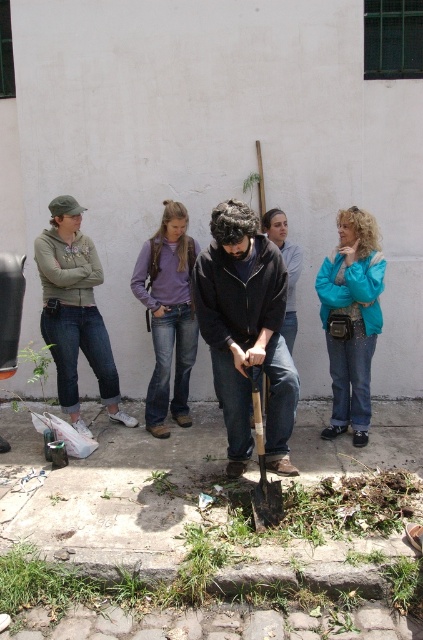
Question: Among these objects, which one is farthest from the camera?

Choices:
 (A) green leafy plant at center
 (B) dark brown leather jacket at center
 (C) green grass at lower left

Answer: (A)

Question: In this image, where is dark brown leather jacket at center located relative to wooden shovel at center?

Choices:
 (A) right
 (B) left

Answer: (B)

Question: Does green leafy plant at lower center have a greater width compared to green leafy plant at lower left?

Choices:
 (A) no
 (B) yes

Answer: (A)

Question: Based on their relative distances, which object is farther from the green cotton hoodie at left?

Choices:
 (A) dark brown leather jacket at center
 (B) green grass at lower left
 (C) wooden shovel at center

Answer: (B)

Question: Estimate the real-world distances between objects in this image. Which object is farther from the green cotton hoodie at left?

Choices:
 (A) green leafy plant at lower left
 (B) green leafy plant at lower center
 (C) purple denim jeans at center

Answer: (B)

Question: Can you confirm if green cotton hoodie at left is positioned above wooden shovel at center?

Choices:
 (A) yes
 (B) no

Answer: (A)